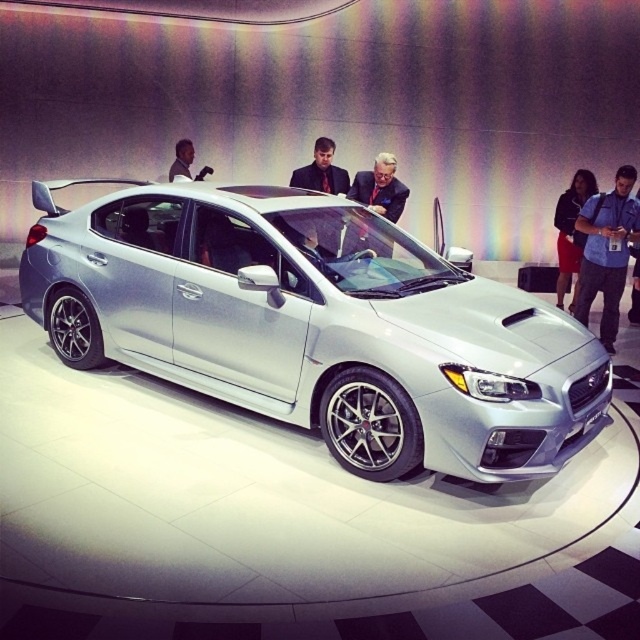
Question: Is matte black suit at center above blue fabric shirt at right?

Choices:
 (A) yes
 (B) no

Answer: (A)

Question: Does red skirt at lower right have a larger size compared to dark brown suit at center?

Choices:
 (A) no
 (B) yes

Answer: (B)

Question: Estimate the real-world distances between objects in this image. Which object is closer to the blue fabric camera at right?

Choices:
 (A) silver metallic car at center
 (B) red skirt at lower right
 (C) blue fabric shirt at right

Answer: (B)

Question: Is silver metallic car at center behind matte black suit at center?

Choices:
 (A) no
 (B) yes

Answer: (A)

Question: Which is nearer to the dark suit at center?

Choices:
 (A) dark skin smooth face at upper center
 (B) red skirt at lower right

Answer: (A)

Question: Which object appears farthest from the camera in this image?

Choices:
 (A) dark skin smooth face at upper center
 (B) blue fabric camera at right
 (C) dark suit at center

Answer: (A)